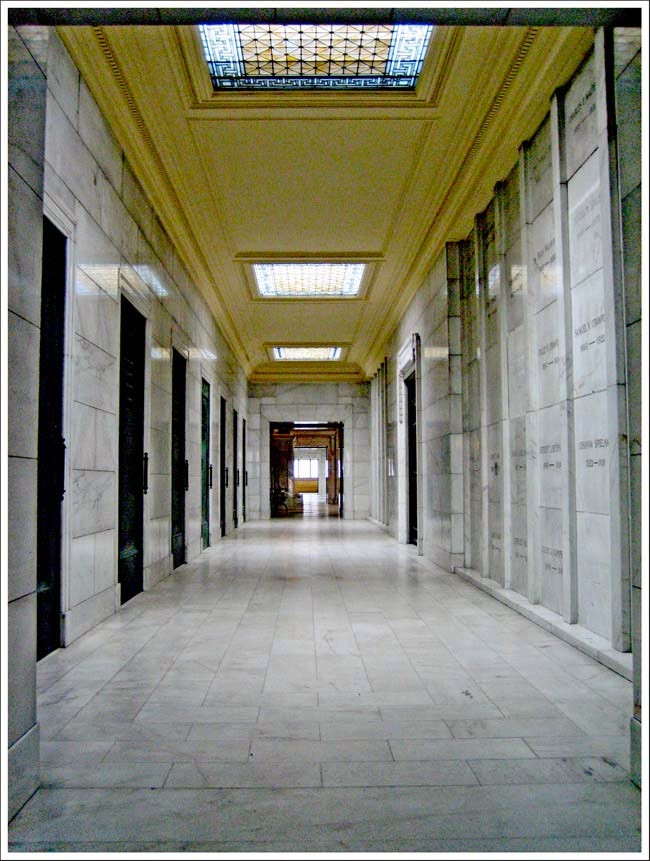
You are a GUI agent. You are given a task and a screenshot of the screen. Output one action in this format:
    pyautogui.click(x=<x>, y=<y>)
    Task: Click on the stain on the floor
    
    Given the screenshot: What is the action you would take?
    [462, 691], [608, 760], [587, 781]